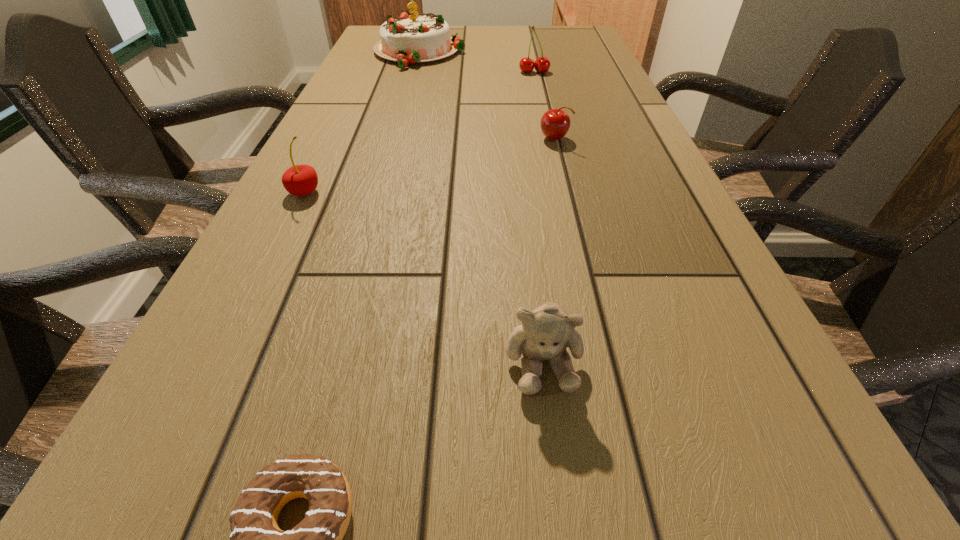
This screenshot has width=960, height=540. Find the location of `vacant space that is in between the leftmost cherry and the third farthest object`. vacant space that is in between the leftmost cherry and the third farthest object is located at coordinates (429, 166).

Find the location of a particular element. unoccupied area between the fifth farthest object and the tallest object is located at coordinates (481, 207).

Locate an element on the screen. The image size is (960, 540). unoccupied position between the nearest cherry and the tallest object is located at coordinates (362, 123).

Where is `empty space that is in between the farthest cherry and the third nearest object`? The height and width of the screenshot is (540, 960). empty space that is in between the farthest cherry and the third nearest object is located at coordinates (420, 132).

This screenshot has width=960, height=540. What are the coordinates of `vacant area that lies between the fifth tallest object and the farthest cherry` in the screenshot? It's located at (544, 106).

Locate an element on the screen. The width and height of the screenshot is (960, 540). vacant area that lies between the tallest object and the teddy bear is located at coordinates (481, 207).

This screenshot has width=960, height=540. I want to click on free area in between the cake and the farthest cherry, so click(477, 63).

Image resolution: width=960 pixels, height=540 pixels. I want to click on the fourth closest object to the third nearest object, so click(x=409, y=39).

You are a GUI agent. You are given a task and a screenshot of the screen. Output one action in this format:
    pyautogui.click(x=<x>, y=<y>)
    Task: Click on the object that ranks as the fifth closest to the teddy bear
    The height and width of the screenshot is (540, 960).
    Given the screenshot: What is the action you would take?
    pyautogui.click(x=409, y=39)

Identify which cherry is located as the nearest to the farthest cherry. Please provide its 2D coordinates. Your answer should be formatted as a tuple, i.e. [(x, y)], where the tuple contains the x and y coordinates of a point satisfying the conditions above.

[(555, 123)]